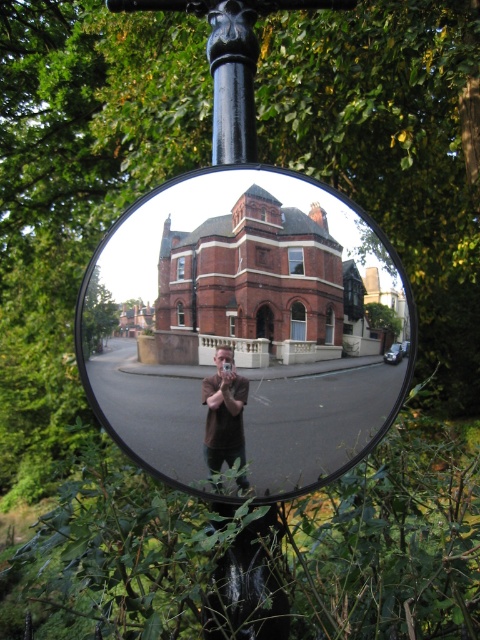
Is matte glass mirror at center thinner than brown leather jacket at center?

No, matte glass mirror at center is not thinner than brown leather jacket at center.

Who is higher up, matte glass mirror at center or brown leather jacket at center?

Positioned higher is matte glass mirror at center.

Who is more distant from viewer, (304, 230) or (239, 454)?

The point (304, 230) is more distant.

This screenshot has height=640, width=480. What are the coordinates of `matte glass mirror at center` in the screenshot? It's located at (244, 332).